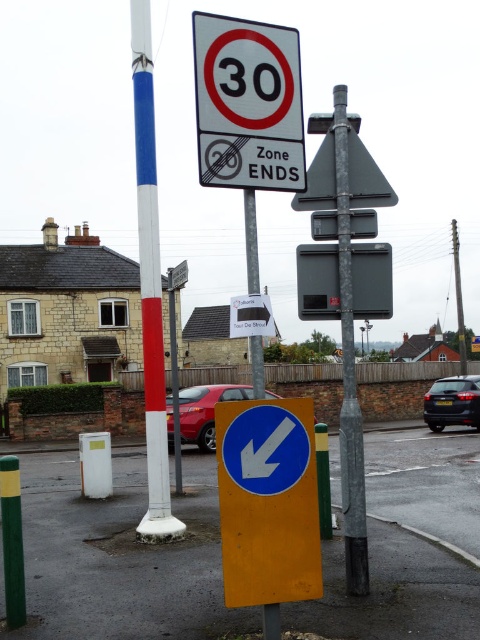
Question: Does white painted pole at center appear on the left side of black glossy car at right?

Choices:
 (A) no
 (B) yes

Answer: (B)

Question: Which of the following is the closest to the observer?

Choices:
 (A) white painted pole at center
 (B) yellow matte arrow sign at lower center

Answer: (B)

Question: Among these objects, which one is nearest to the camera?

Choices:
 (A) metallic triangular sign at upper center
 (B) galvanized steel pole at center
 (C) yellow matte arrow sign at lower center
 (D) metallic red car at center

Answer: (C)

Question: Is white plastic speed limit sign at upper center positioned behind metallic triangular sign at upper center?

Choices:
 (A) yes
 (B) no

Answer: (B)

Question: Which of the following is the farthest from the observer?

Choices:
 (A) (162, 428)
 (B) (374, 161)

Answer: (B)

Question: Is yellow matte arrow sign at lower center closer to camera compared to galvanized steel pole at center?

Choices:
 (A) no
 (B) yes

Answer: (B)